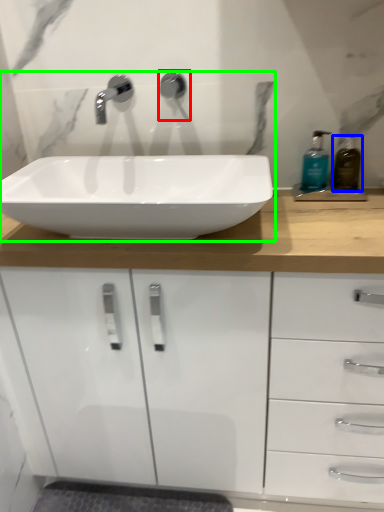
Question: Which is nearer to the plumbing fixture (highlighted by a red box)? soap dispenser (highlighted by a blue box) or sink (highlighted by a green box).

Choices:
 (A) soap dispenser
 (B) sink

Answer: (B)